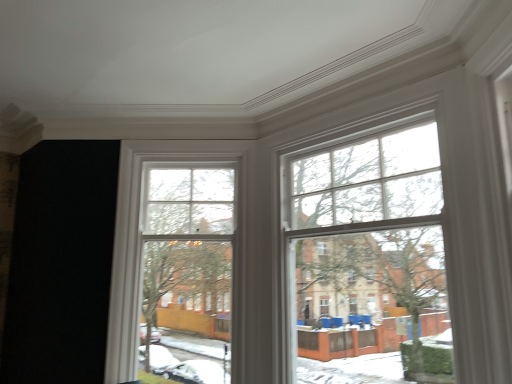
I want to click on clear glass window at center, arranged as the first bay window when viewed from the left, so click(187, 243).

How much space does clear glass window at center, arranged as the first bay window when viewed from the left, occupy horizontally?

clear glass window at center, arranged as the first bay window when viewed from the left, is 14.42 inches in width.

The height and width of the screenshot is (384, 512). Describe the element at coordinates (187, 243) in the screenshot. I see `clear glass window at center, which is the 2th bay window from right to left` at that location.

Measure the distance between clear glass window at upper right, the 2th bay window from the left, and camera.

The distance of clear glass window at upper right, the 2th bay window from the left, from camera is 6.95 feet.

In order to face clear glass window at upper right, which appears as the first bay window when viewed from the right, should I rotate leftwards or rightwards?

Turn right by 13.743 degrees to look at clear glass window at upper right, which appears as the first bay window when viewed from the right.

Where is `clear glass window at upper right, which appears as the first bay window when viewed from the right`? The width and height of the screenshot is (512, 384). clear glass window at upper right, which appears as the first bay window when viewed from the right is located at coordinates (367, 251).

Based on the photo, what is the approximate height of clear glass window at upper right, which appears as the first bay window when viewed from the right?

clear glass window at upper right, which appears as the first bay window when viewed from the right, is 5.74 feet tall.

Describe the element at coordinates (367, 251) in the screenshot. I see `clear glass window at upper right, the 2th bay window from the left` at that location.

Find the location of a particular element. This screenshot has width=512, height=384. clear glass window at center, arranged as the first bay window when viewed from the left is located at coordinates (187, 243).

Which is more to the right, clear glass window at upper right, the 2th bay window from the left, or clear glass window at center, which is the 2th bay window from right to left?

clear glass window at upper right, the 2th bay window from the left.

Considering the relative positions of clear glass window at upper right, which appears as the first bay window when viewed from the right, and clear glass window at center, which is the 2th bay window from right to left, in the image provided, is clear glass window at upper right, which appears as the first bay window when viewed from the right, behind clear glass window at center, which is the 2th bay window from right to left,?

No, it is in front of clear glass window at center, which is the 2th bay window from right to left.

Which point is more forward, (385,191) or (222,232)?

The point (385,191) is in front.

From the image's perspective, between clear glass window at upper right, which appears as the first bay window when viewed from the right, and clear glass window at center, arranged as the first bay window when viewed from the left, which one is located above?

clear glass window at upper right, which appears as the first bay window when viewed from the right.

From a real-world perspective, is clear glass window at upper right, which appears as the first bay window when viewed from the right, positioned above or below clear glass window at center, which is the 2th bay window from right to left?

clear glass window at upper right, which appears as the first bay window when viewed from the right, is above clear glass window at center, which is the 2th bay window from right to left.

From the picture: Is clear glass window at upper right, the 2th bay window from the left, wider or thinner than clear glass window at center, arranged as the first bay window when viewed from the left?

clear glass window at upper right, the 2th bay window from the left, is thinner than clear glass window at center, arranged as the first bay window when viewed from the left.

Considering the sizes of objects clear glass window at upper right, the 2th bay window from the left, and clear glass window at center, which is the 2th bay window from right to left, in the image provided, who is taller, clear glass window at upper right, the 2th bay window from the left, or clear glass window at center, which is the 2th bay window from right to left,?

clear glass window at center, which is the 2th bay window from right to left.

Can you confirm if clear glass window at upper right, the 2th bay window from the left, is smaller than clear glass window at center, which is the 2th bay window from right to left?

Incorrect, clear glass window at upper right, the 2th bay window from the left, is not smaller in size than clear glass window at center, which is the 2th bay window from right to left.

Is clear glass window at center, which is the 2th bay window from right to left, surrounded by clear glass window at upper right, which appears as the first bay window when viewed from the right?

No, clear glass window at center, which is the 2th bay window from right to left, is located outside of clear glass window at upper right, which appears as the first bay window when viewed from the right.

Is clear glass window at upper right, the 2th bay window from the left, beside clear glass window at center, which is the 2th bay window from right to left?

No, clear glass window at upper right, the 2th bay window from the left, is not next to clear glass window at center, which is the 2th bay window from right to left.

Looking at this image, is clear glass window at upper right, the 2th bay window from the left, oriented towards clear glass window at center, arranged as the first bay window when viewed from the left?

No.

Where is `bay window that appears on the right of clear glass window at center, arranged as the first bay window when viewed from the left`? The width and height of the screenshot is (512, 384). bay window that appears on the right of clear glass window at center, arranged as the first bay window when viewed from the left is located at coordinates (367, 251).

Considering the positions of objects clear glass window at center, which is the 2th bay window from right to left, and clear glass window at upper right, which appears as the first bay window when viewed from the right, in the image provided, who is more to the right, clear glass window at center, which is the 2th bay window from right to left, or clear glass window at upper right, which appears as the first bay window when viewed from the right,?

clear glass window at upper right, which appears as the first bay window when viewed from the right, is more to the right.

From the picture: Does clear glass window at center, which is the 2th bay window from right to left, come behind clear glass window at upper right, the 2th bay window from the left?

Yes, clear glass window at center, which is the 2th bay window from right to left, is further from the camera.

Does point (167, 237) come behind point (372, 226)?

Yes, it is.

From the image's perspective, is clear glass window at center, which is the 2th bay window from right to left, below clear glass window at upper right, the 2th bay window from the left?

Correct, clear glass window at center, which is the 2th bay window from right to left, appears lower than clear glass window at upper right, the 2th bay window from the left, in the image.

From a real-world perspective, is clear glass window at center, which is the 2th bay window from right to left, below clear glass window at upper right, the 2th bay window from the left?

Yes, from a real-world perspective, clear glass window at center, which is the 2th bay window from right to left, is under clear glass window at upper right, the 2th bay window from the left.

Looking at this image, can you confirm if clear glass window at center, which is the 2th bay window from right to left, is thinner than clear glass window at upper right, which appears as the first bay window when viewed from the right?

No.

In terms of height, does clear glass window at center, arranged as the first bay window when viewed from the left, look taller or shorter compared to clear glass window at upper right, the 2th bay window from the left?

clear glass window at center, arranged as the first bay window when viewed from the left, is taller than clear glass window at upper right, the 2th bay window from the left.

Can you confirm if clear glass window at center, which is the 2th bay window from right to left, is bigger than clear glass window at upper right, which appears as the first bay window when viewed from the right?

Incorrect, clear glass window at center, which is the 2th bay window from right to left, is not larger than clear glass window at upper right, which appears as the first bay window when viewed from the right.

Which is correct: clear glass window at center, which is the 2th bay window from right to left, is inside clear glass window at upper right, which appears as the first bay window when viewed from the right, or outside of it?

clear glass window at center, which is the 2th bay window from right to left, cannot be found inside clear glass window at upper right, which appears as the first bay window when viewed from the right.

Is clear glass window at center, arranged as the first bay window when viewed from the left, beside clear glass window at upper right, the 2th bay window from the left?

No, clear glass window at center, arranged as the first bay window when viewed from the left, is not in contact with clear glass window at upper right, the 2th bay window from the left.

Is clear glass window at center, which is the 2th bay window from right to left, turned away from clear glass window at upper right, which appears as the first bay window when viewed from the right?

No.

What's the angular difference between clear glass window at center, which is the 2th bay window from right to left, and clear glass window at upper right, which appears as the first bay window when viewed from the right,'s facing directions?

41.7 degrees separate the facing orientations of clear glass window at center, which is the 2th bay window from right to left, and clear glass window at upper right, which appears as the first bay window when viewed from the right.

Could you measure the distance between clear glass window at center, which is the 2th bay window from right to left, and clear glass window at upper right, which appears as the first bay window when viewed from the right?

clear glass window at center, which is the 2th bay window from right to left, and clear glass window at upper right, which appears as the first bay window when viewed from the right, are 34.84 inches apart.

Identify the location of bay window on the right of the clear glass window at center, arranged as the first bay window when viewed from the left. This screenshot has height=384, width=512. (367, 251).

At what (x,y) coordinates should I click in order to perform the action: click on bay window on the right of clear glass window at center, arranged as the first bay window when viewed from the left. Please return your answer as a coordinate pair (x, y). Image resolution: width=512 pixels, height=384 pixels. Looking at the image, I should click on (367, 251).

This screenshot has width=512, height=384. Find the location of `bay window below the clear glass window at upper right, the 2th bay window from the left (from a real-world perspective)`. bay window below the clear glass window at upper right, the 2th bay window from the left (from a real-world perspective) is located at coordinates (187, 243).